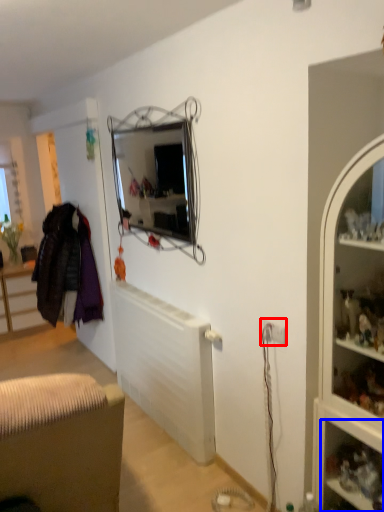
Question: Among these objects, which one is nearest to the camera, electric outlet (highlighted by a red box) or shelf (highlighted by a blue box)?

Choices:
 (A) electric outlet
 (B) shelf

Answer: (B)